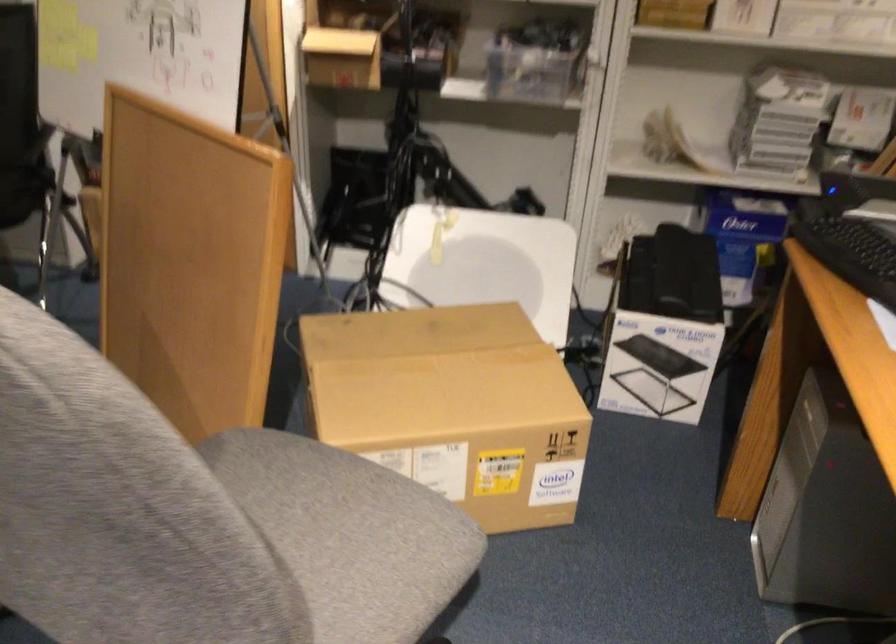
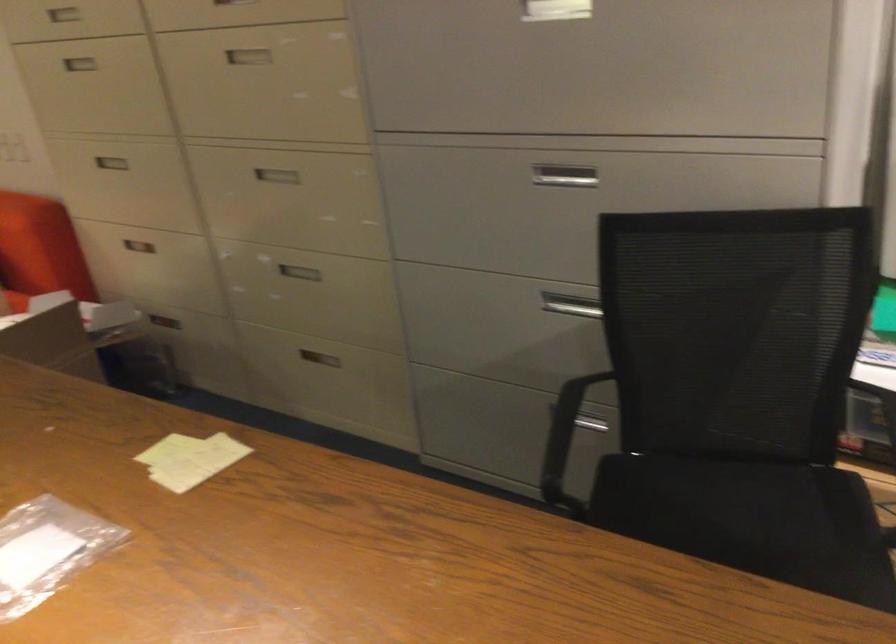
The images are taken continuously from a first-person perspective. In which direction are you moving?

The cameraman walked toward left, forward.